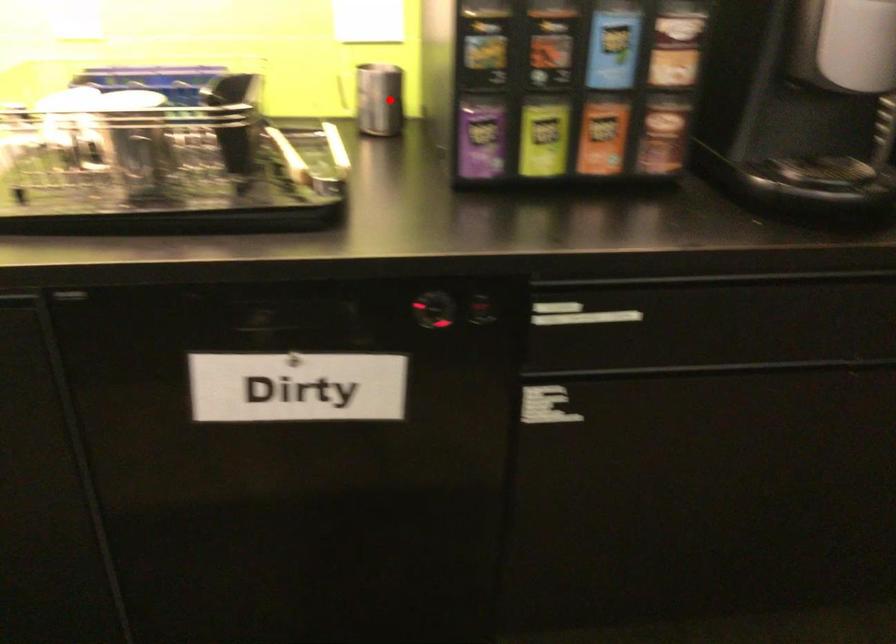
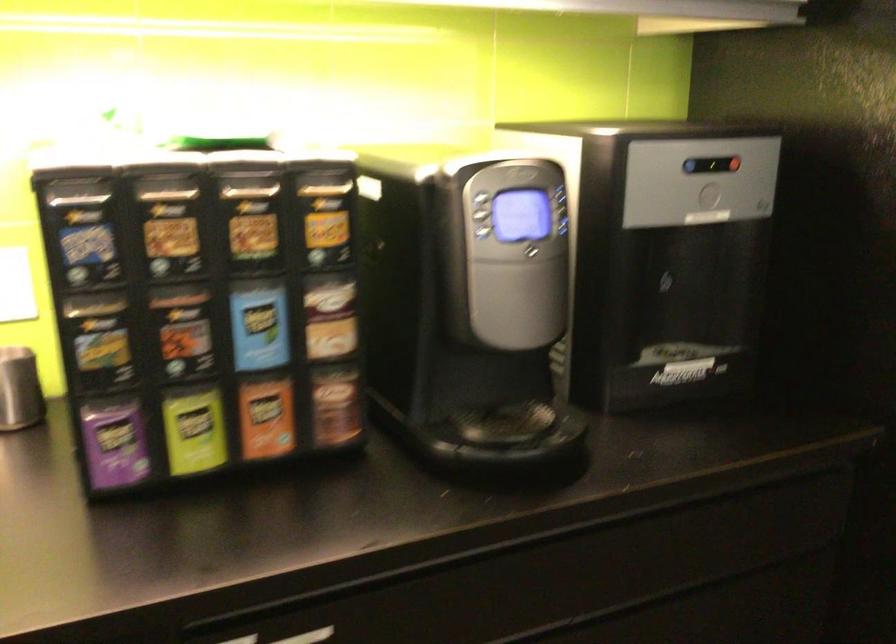
Question: I am providing you with two images of the same scene from different viewpoints. Image1 has a red point marked. In image2, the corresponding 3D location appears at what relative position? Reply with the corresponding letter.

Choices:
 (A) Closer
 (B) Farther

Answer: (A)